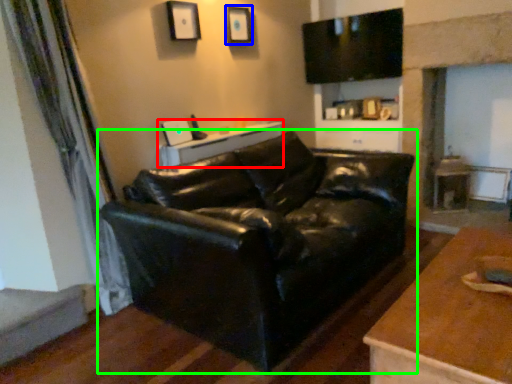
Question: Which object is the farthest from table (highlighted by a red box)? Choose among these: picture frame (highlighted by a blue box) or studio couch (highlighted by a green box).

Choices:
 (A) picture frame
 (B) studio couch

Answer: (A)